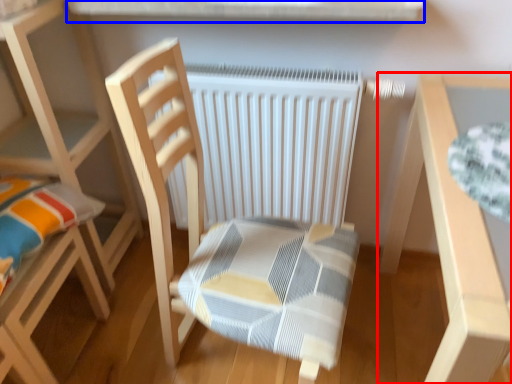
Question: Which object appears closest to the camera in this image, table (highlighted by a red box) or window sill (highlighted by a blue box)?

Choices:
 (A) table
 (B) window sill

Answer: (A)